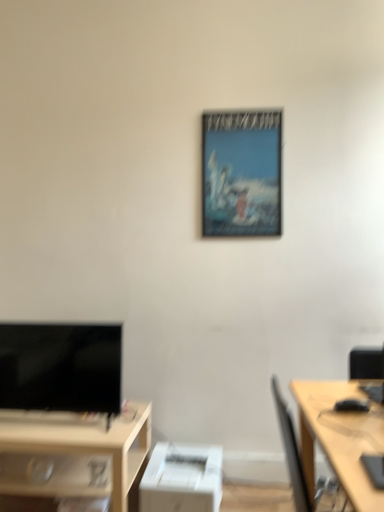
Question: From a real-world perspective, is black glossy tv at lower left above or below matte white desk at lower left, the 2th desk when ordered from top to bottom?

Choices:
 (A) above
 (B) below

Answer: (A)

Question: Which is correct: black glossy tv at lower left is inside matte white desk at lower left, placed as the second desk when sorted from front to back, or outside of it?

Choices:
 (A) outside
 (B) inside

Answer: (A)

Question: Which object is the farthest from the matte white desk at lower left, marked as the second desk in a right-to-left arrangement?

Choices:
 (A) white matte printer at lower center
 (B) light wood desk at right, placed as the 1th desk when sorted from top to bottom
 (C) black glossy tv at lower left
 (D) metallic poster at center

Answer: (D)

Question: Which object is the closest to the light wood desk at right, which is counted as the second desk, starting from the bottom?

Choices:
 (A) matte white desk at lower left, arranged as the 1th desk when ordered from the bottom
 (B) metallic poster at center
 (C) white matte printer at lower center
 (D) black glossy tv at lower left

Answer: (C)